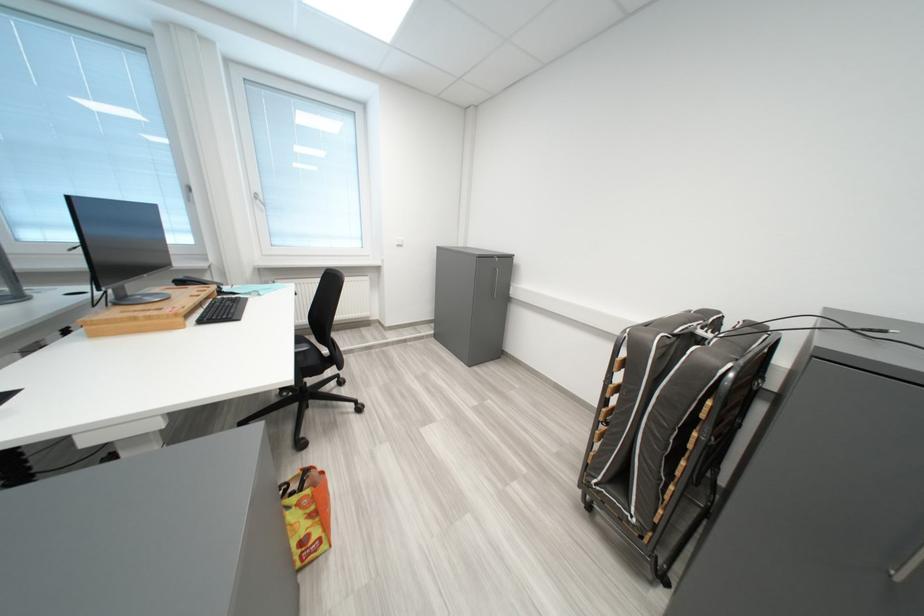
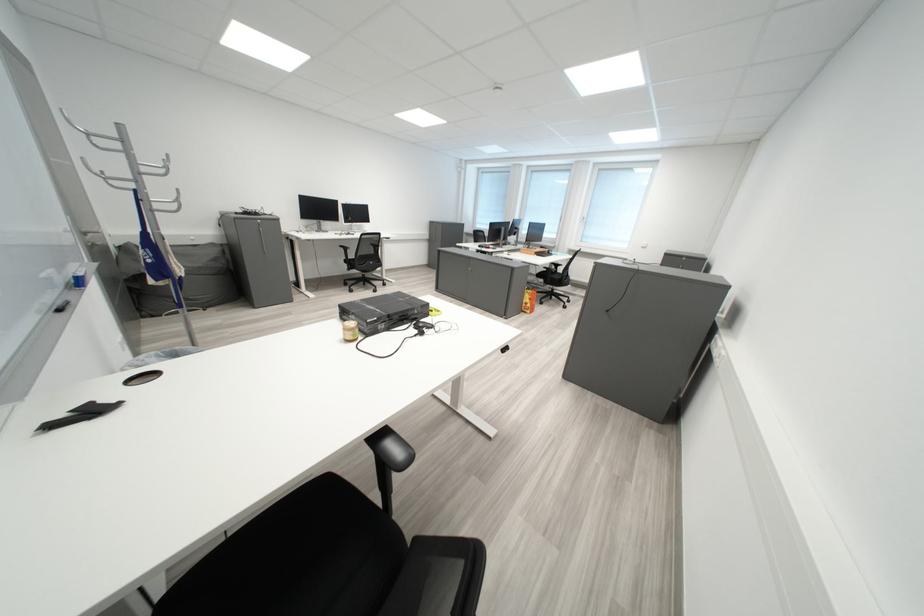
Locate, in the second image, the point that corresponds to pixel 482 519 in the first image.

(574, 333)